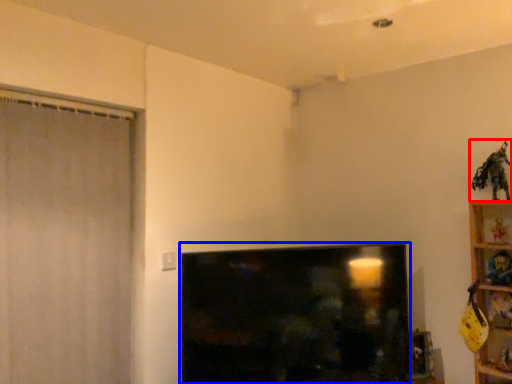
Question: Which object appears closest to the camera in this image, toy (highlighted by a red box) or television (highlighted by a blue box)?

Choices:
 (A) toy
 (B) television

Answer: (B)